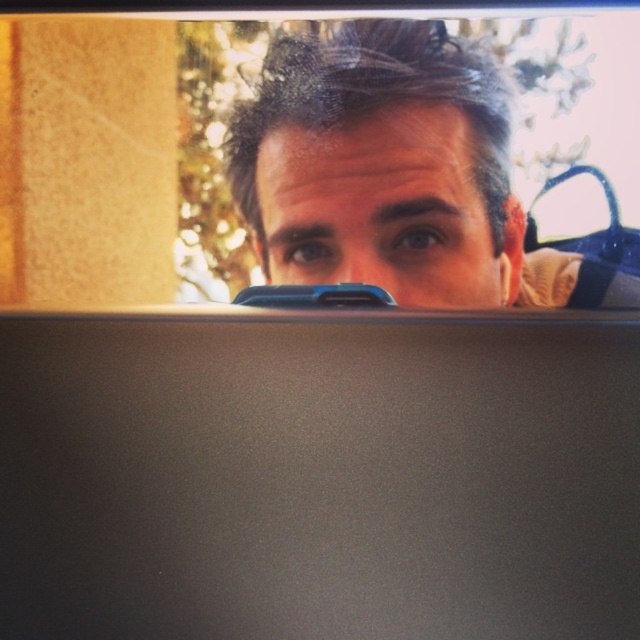
Is matte black view mirror at upper center shorter than matte black hair at upper center?

No.

Is matte black view mirror at upper center wider than matte black hair at upper center?

Yes, matte black view mirror at upper center is wider than matte black hair at upper center.

Is point (339, 97) farther from viewer compared to point (428, 298)?

No.

You are a GUI agent. You are given a task and a screenshot of the screen. Output one action in this format:
    pyautogui.click(x=<x>, y=<y>)
    Task: Click on the matte black view mirror at upper center
    The width and height of the screenshot is (640, 640).
    Given the screenshot: What is the action you would take?
    pyautogui.click(x=422, y=177)